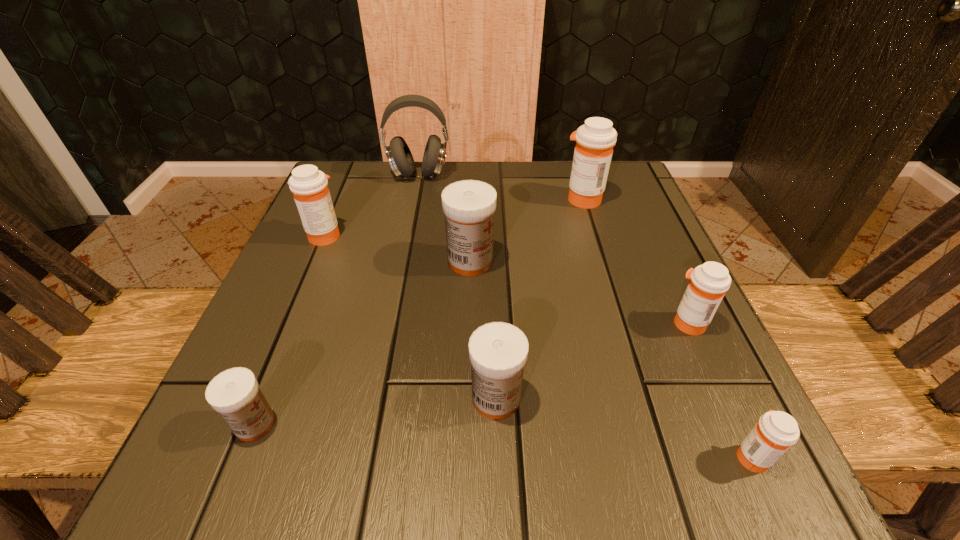
Identify the location of vacant point located between the second farthest object and the second biggest white medicine. (540, 299).

At what (x,y) coordinates should I click in order to perform the action: click on the seventh closest object to the farthest object. Please return your answer as a coordinate pair (x, y). The width and height of the screenshot is (960, 540). Looking at the image, I should click on (775, 432).

At what (x,y) coordinates should I click in order to perform the action: click on the fourth closest object to the farthest object. Please return your answer as a coordinate pair (x, y). Looking at the image, I should click on (498, 351).

Select which medicine appears as the second closest to the biggest white medicine. Please provide its 2D coordinates. Your answer should be formatted as a tuple, i.e. [(x, y)], where the tuple contains the x and y coordinates of a point satisfying the conditions above.

[(498, 351)]

Identify which medicine is the sixth nearest to the second biggest white medicine. Please provide its 2D coordinates. Your answer should be formatted as a tuple, i.e. [(x, y)], where the tuple contains the x and y coordinates of a point satisfying the conditions above.

[(595, 140)]

Locate which orange medicine is the closest to the third farthest orange medicine. Please provide its 2D coordinates. Your answer should be formatted as a tuple, i.e. [(x, y)], where the tuple contains the x and y coordinates of a point satisfying the conditions above.

[(775, 432)]

The width and height of the screenshot is (960, 540). In order to click on orange medicine that stands as the closest to the third nearest orange medicine in this screenshot , I will do `click(595, 140)`.

Select which white medicine is the second closest to the biggest white medicine. Please provide its 2D coordinates. Your answer should be formatted as a tuple, i.e. [(x, y)], where the tuple contains the x and y coordinates of a point satisfying the conditions above.

[(234, 393)]

Identify which white medicine is located as the nearest to the smallest white medicine. Please provide its 2D coordinates. Your answer should be formatted as a tuple, i.e. [(x, y)], where the tuple contains the x and y coordinates of a point satisfying the conditions above.

[(498, 351)]

Identify the location of vacant region that satisfies the following two spatial constraints: 1. on the ear cups of the biggest orange medicine; 2. on the right side of the headset. (414, 199).